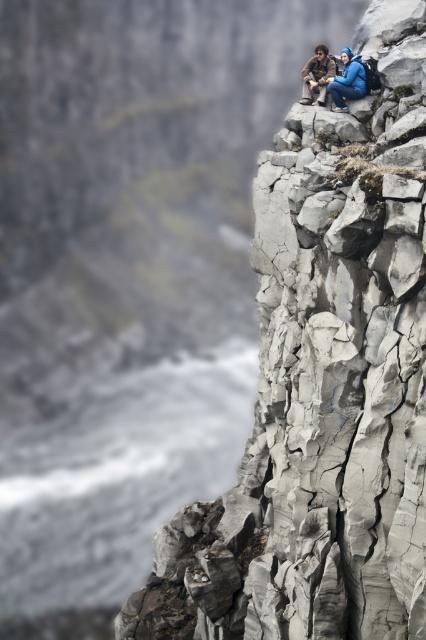
Can you confirm if gray cracked rock at upper center is positioned above brown leather jacket at upper center?

Incorrect, gray cracked rock at upper center is not positioned above brown leather jacket at upper center.

Which of these two, gray cracked rock at upper center or brown leather jacket at upper center, stands taller?

Standing taller between the two is brown leather jacket at upper center.

Locate an element on the screen. The image size is (426, 640). gray cracked rock at upper center is located at coordinates pos(324,387).

Between point (342, 378) and point (330, 88), which one is positioned in front?

Point (342, 378)

Consider the image. Who is higher up, gray cracked rock at upper center or blue fabric jacket at upper center?

blue fabric jacket at upper center is above.

Where is `gray cracked rock at upper center`? This screenshot has width=426, height=640. gray cracked rock at upper center is located at coordinates (324, 387).

Locate an element on the screen. gray cracked rock at upper center is located at coordinates (324, 387).

Which is above, blue fabric jacket at upper center or brown leather jacket at upper center?

brown leather jacket at upper center is higher up.

Is point (336, 109) closer to camera compared to point (319, 100)?

Yes, it is in front of point (319, 100).

Is point (354, 76) less distant than point (325, 52)?

Yes, point (354, 76) is in front of point (325, 52).

Find the location of a particular element. blue fabric jacket at upper center is located at coordinates click(x=336, y=77).